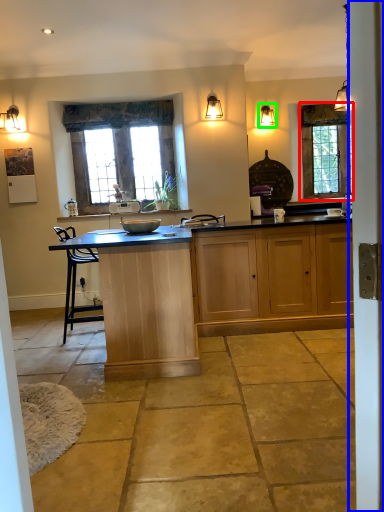
Question: Which object is positioned farthest from window (highlighted by a red box)? Select from screen door (highlighted by a blue box) and lamp (highlighted by a green box).

Choices:
 (A) screen door
 (B) lamp

Answer: (A)